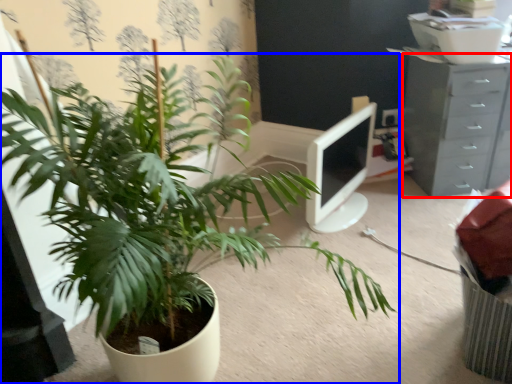
Question: Which of the following is the closest to the observer, chest of drawers (highlighted by a red box) or houseplant (highlighted by a blue box)?

Choices:
 (A) chest of drawers
 (B) houseplant

Answer: (B)